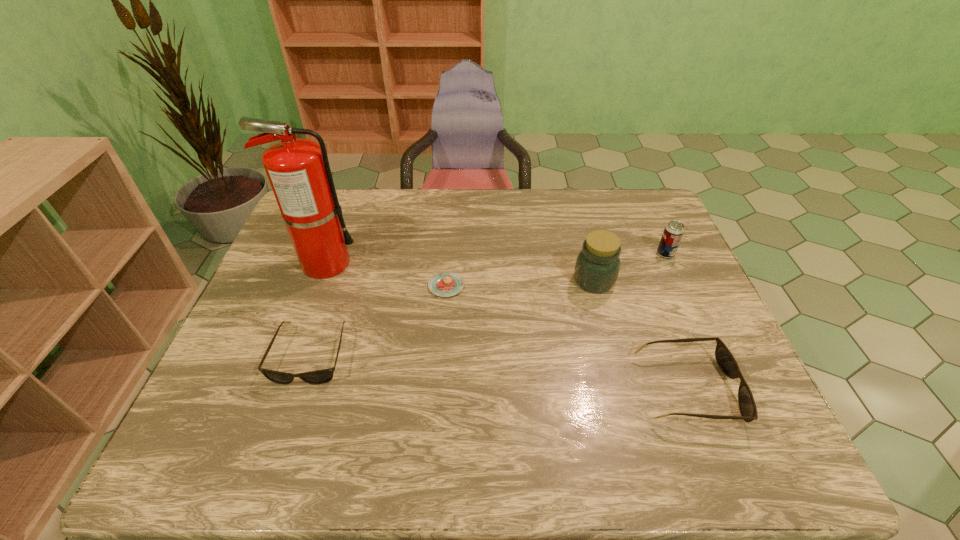
At what (x,y) coordinates should I click in order to perform the action: click on vacant point located between the tallest object and the third tallest object. Please return your answer as a coordinate pair (x, y). This screenshot has width=960, height=540. Looking at the image, I should click on (495, 258).

Identify the location of vacant area between the shorter sunglasses and the fourth object from right to left. The width and height of the screenshot is (960, 540). (378, 320).

This screenshot has height=540, width=960. Find the location of `vacant area between the tallest object and the third tallest object`. vacant area between the tallest object and the third tallest object is located at coordinates pos(495,258).

Find the location of a particular element. The width and height of the screenshot is (960, 540). free space that is in between the shortest object and the left sunglasses is located at coordinates tap(378, 320).

The height and width of the screenshot is (540, 960). What are the coordinates of `object that is the third closest one to the shortest object` in the screenshot? It's located at (597, 266).

Choose which object is the third nearest neighbor to the jar. Please provide its 2D coordinates. Your answer should be formatted as a tuple, i.e. [(x, y)], where the tuple contains the x and y coordinates of a point satisfying the conditions above.

[(444, 284)]

Locate an element on the screen. The height and width of the screenshot is (540, 960). free spot that satisfies the following two spatial constraints: 1. on the back side of the second tallest object; 2. at the nozzle of the fire extinguisher is located at coordinates (589, 263).